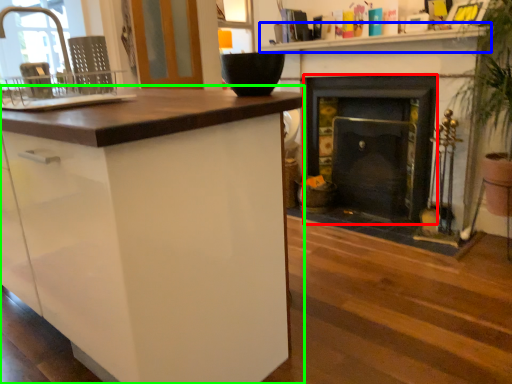
Question: Which object is the farthest from fireplace (highlighted by a red box)? Choose among these: counter top (highlighted by a blue box) or cabinetry (highlighted by a green box).

Choices:
 (A) counter top
 (B) cabinetry

Answer: (B)